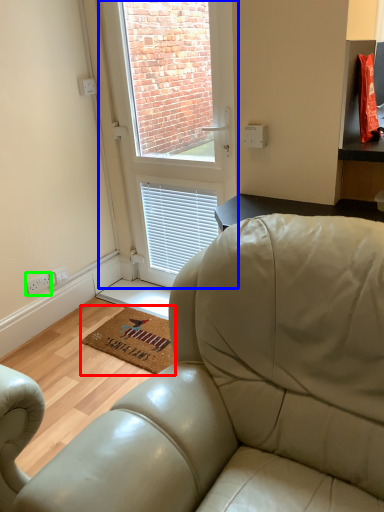
Question: Estimate the real-world distances between objects in this image. Which object is closer to mat (highlighted by a red box), window (highlighted by a blue box) or electric outlet (highlighted by a green box)?

Choices:
 (A) window
 (B) electric outlet

Answer: (B)